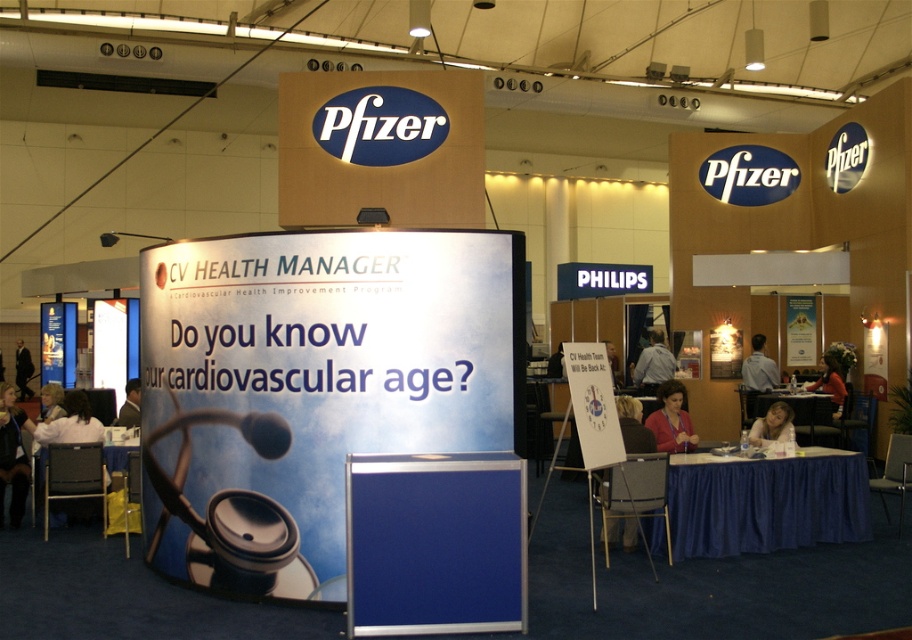
You are standing at the Pfizer booth and want to hand a brochure to a person wearing the dark blue shirt at lower left. There is a blue velvet table at lower right in your way. Can you reach the person without moving the table?

The blue velvet table at lower right is closer to the viewer than the dark blue shirt at lower left, so you would need to move around or past the table to reach the person wearing the dark blue shirt at lower left.

You are attending a Pfizer convention and notice two people in the foreground. One is wearing a gray fabric shirt at center and the other a dark blue suit at left. Which of these two has a narrower torso?

The gray fabric shirt at center has a lesser width compared to dark blue suit at left, so the person wearing the gray fabric shirt at center has a narrower torso.

You are at the Pfizer booth and need to place a brochure on the blue velvet table at lower right. Based on the coordinates provided, where exactly should you place the brochure?

The blue velvet table at lower right is located at point (x=765, y=502), so you should place the brochure there.